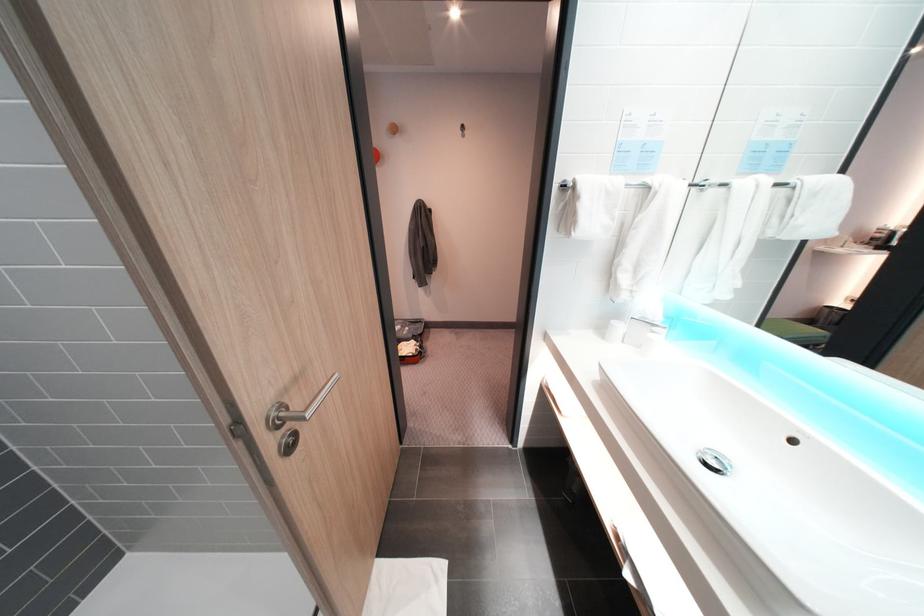
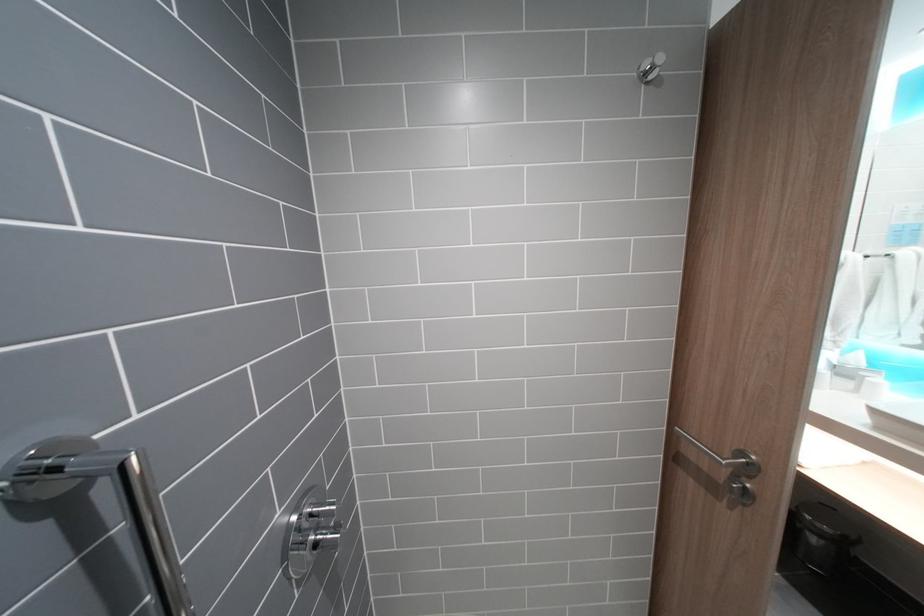
Question: Which direction would the cameraman need to move to produce the second image? Reply with the corresponding letter.

Choices:
 (A) Left
 (B) Right
 (C) Forward
 (D) Backward

Answer: (A)